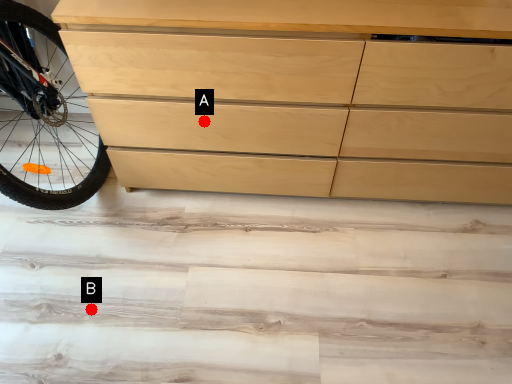
Question: Two points are circled on the image, labeled by A and B beside each circle. Which point is closer to the camera?

Choices:
 (A) A is closer
 (B) B is closer

Answer: (A)